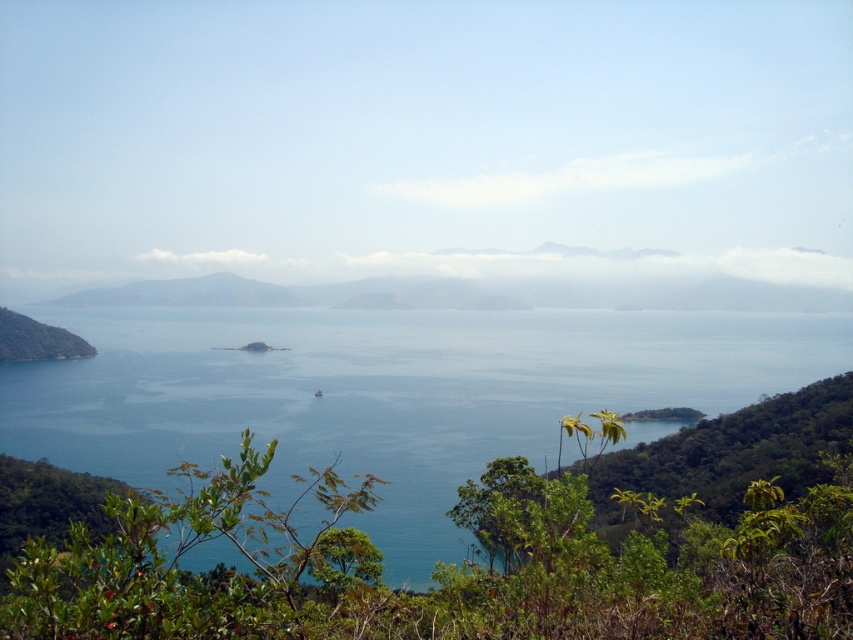
You are planning to take a photo of the blue water at center and the green leafy hillside at left. Which object will occupy more space in the photo?

The blue water at center occupies more space in the photo because it is bigger than the green leafy hillside at left.

You are standing on the green leafy hillside at left and want to reach the blue water at center. Which direction should you head towards?

The blue water at center is to the right of green leafy hillside at left, so you should head towards the right direction to reach it.

You are standing at the edge of the coastal landscape and want to take a photo that includes both the blue water at center and the green leafy hillside at left. Based on their positions, which object should appear closer to you in the photo?

The blue water at center appears closer to you in the photo because it is positioned in front of the green leafy hillside at left.